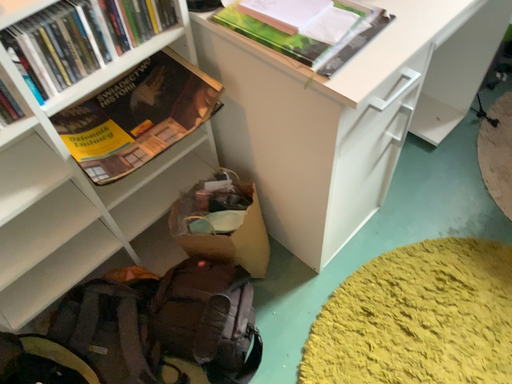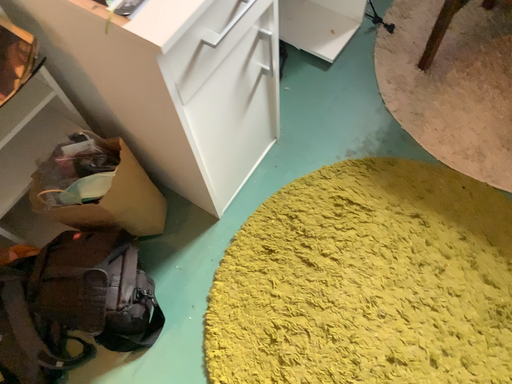
Question: How did the camera likely rotate when shooting the video?

Choices:
 (A) rotated downward
 (B) rotated upward

Answer: (A)